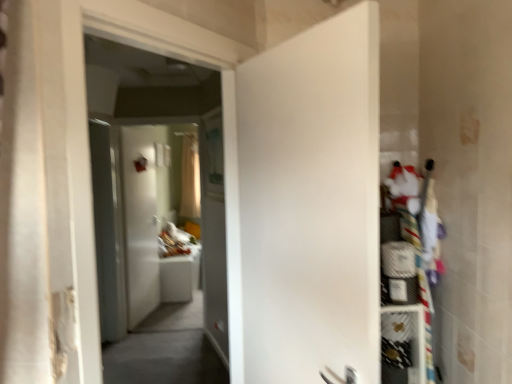
Question: Is white matte door at center, marked as the 2th door in a left-to-right arrangement, facing towards white fabric shelf at right, the second shelf positioned from the bottom?

Choices:
 (A) yes
 (B) no

Answer: (A)

Question: Is white matte door at center, which is the 2th door in back-to-front order, wider than white fabric shelf at right, the second shelf positioned from the bottom?

Choices:
 (A) no
 (B) yes

Answer: (A)

Question: Does white matte door at center, marked as the 2th door in a left-to-right arrangement, have a larger size compared to white fabric shelf at right, the first shelf in the top-to-bottom sequence?

Choices:
 (A) no
 (B) yes

Answer: (B)

Question: Does white matte door at center, marked as the first door in a front-to-back arrangement, appear on the left side of white fabric shelf at right, the first shelf in the top-to-bottom sequence?

Choices:
 (A) no
 (B) yes

Answer: (B)

Question: Is white matte door at center, placed as the 1th door when sorted from right to left, outside white fabric shelf at right, the second shelf positioned from the bottom?

Choices:
 (A) no
 (B) yes

Answer: (B)

Question: Is white glossy door at center, positioned as the first door in back-to-front order, in front of or behind transparent glass screen door at left in the image?

Choices:
 (A) behind
 (B) front

Answer: (A)

Question: Is white glossy door at center, placed as the 1th door when sorted from left to right, spatially inside transparent glass screen door at left, or outside of it?

Choices:
 (A) inside
 (B) outside

Answer: (B)

Question: From a real-world perspective, relative to transparent glass screen door at left, is white glossy door at center, placed as the 1th door when sorted from left to right, vertically above or below?

Choices:
 (A) below
 (B) above

Answer: (A)

Question: Considering the positions of white glossy door at center, placed as the 1th door when sorted from left to right, and transparent glass screen door at left in the image, is white glossy door at center, placed as the 1th door when sorted from left to right, wider or thinner than transparent glass screen door at left?

Choices:
 (A) thin
 (B) wide

Answer: (A)

Question: Considering the relative positions of white mesh shelf at right, the first shelf in the bottom-to-top sequence, and translucent fabric curtain at center in the image provided, is white mesh shelf at right, the first shelf in the bottom-to-top sequence, to the left or to the right of translucent fabric curtain at center?

Choices:
 (A) right
 (B) left

Answer: (A)

Question: From a real-world perspective, relative to translucent fabric curtain at center, is white mesh shelf at right, which ranks as the second shelf in top-to-bottom order, vertically above or below?

Choices:
 (A) above
 (B) below

Answer: (B)

Question: Considering their positions, is white mesh shelf at right, the first shelf in the bottom-to-top sequence, located in front of or behind translucent fabric curtain at center?

Choices:
 (A) behind
 (B) front

Answer: (B)

Question: Considering the positions of white mesh shelf at right, the first shelf in the bottom-to-top sequence, and translucent fabric curtain at center in the image, is white mesh shelf at right, the first shelf in the bottom-to-top sequence, wider or thinner than translucent fabric curtain at center?

Choices:
 (A) wide
 (B) thin

Answer: (B)

Question: Looking at their shapes, would you say transparent glass screen door at left is wider or thinner than white glossy door at center, the 2th door from the right?

Choices:
 (A) wide
 (B) thin

Answer: (A)

Question: Is transparent glass screen door at left in front of or behind white glossy door at center, placed as the 1th door when sorted from left to right, in the image?

Choices:
 (A) front
 (B) behind

Answer: (A)